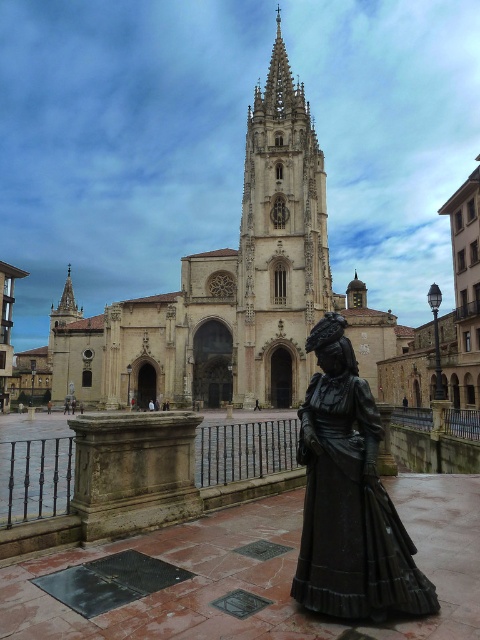
Between light beige stone church at center and bronze statue at lower right, which one appears on the right side from the viewer's perspective?

From the viewer's perspective, bronze statue at lower right appears more on the right side.

Who is more forward, (284, 212) or (342, 518)?

Point (342, 518)

Where is `light beige stone church at center`? This screenshot has width=480, height=640. light beige stone church at center is located at coordinates (232, 291).

Can you confirm if light beige stone church at center is shorter than smooth stone tower at center?

No.

Who is positioned more to the right, light beige stone church at center or smooth stone tower at center?

smooth stone tower at center is more to the right.

Is point (78, 308) less distant than point (297, 388)?

No, it is not.

This screenshot has width=480, height=640. What are the coordinates of `light beige stone church at center` in the screenshot? It's located at (232, 291).

Is point (311, 154) in front of point (300, 595)?

No, it is behind (300, 595).

Is smooth stone tower at center bigger than bronze statue at lower right?

Correct, smooth stone tower at center is larger in size than bronze statue at lower right.

Which is in front, point (269, 237) or point (345, 536)?

Positioned in front is point (345, 536).

Locate an element on the screen. This screenshot has height=640, width=480. smooth stone tower at center is located at coordinates (279, 243).